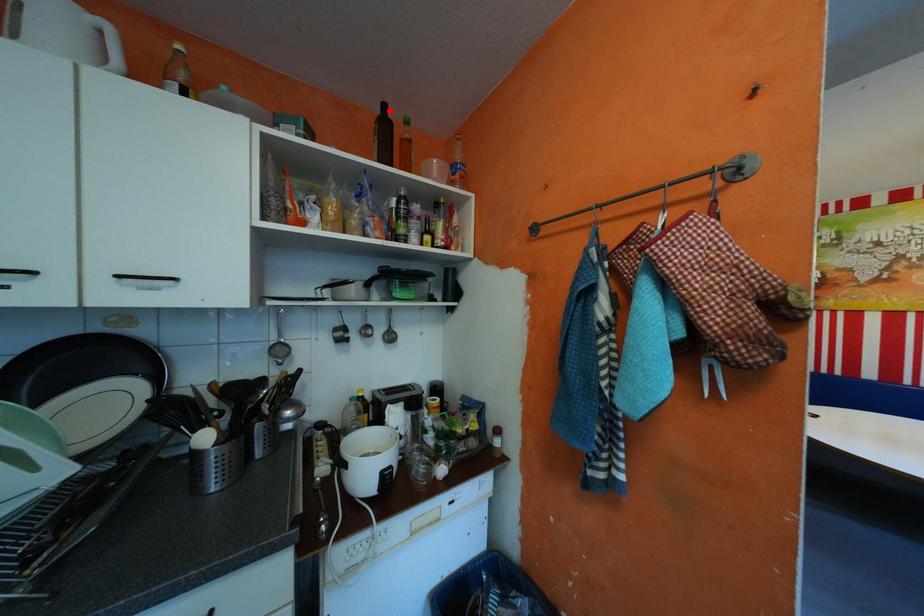
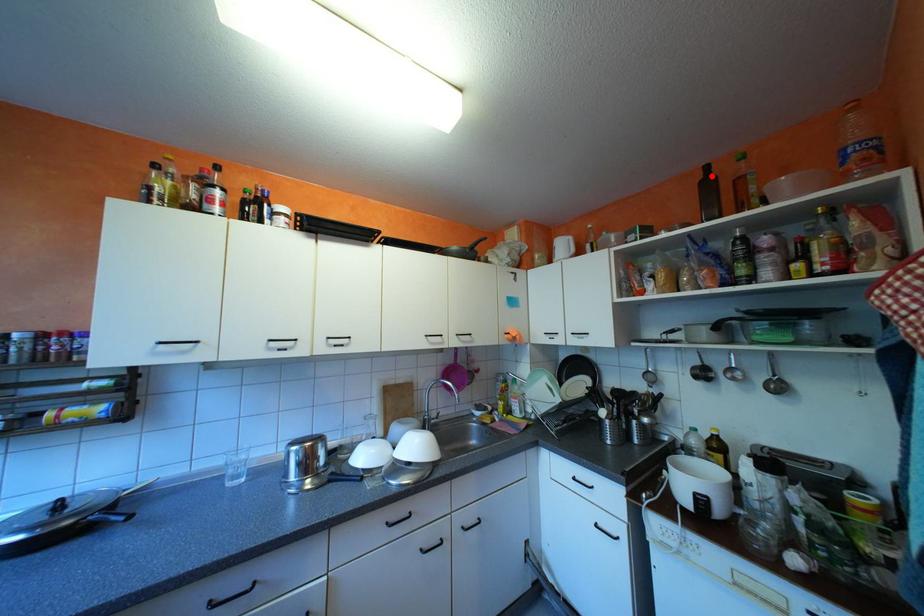
I am providing you with two images of the same scene from different viewpoints. A red point is marked on the first image and another point is marked on the second image. Is the red point in image1 aligned with the point shown in image2?

Yes